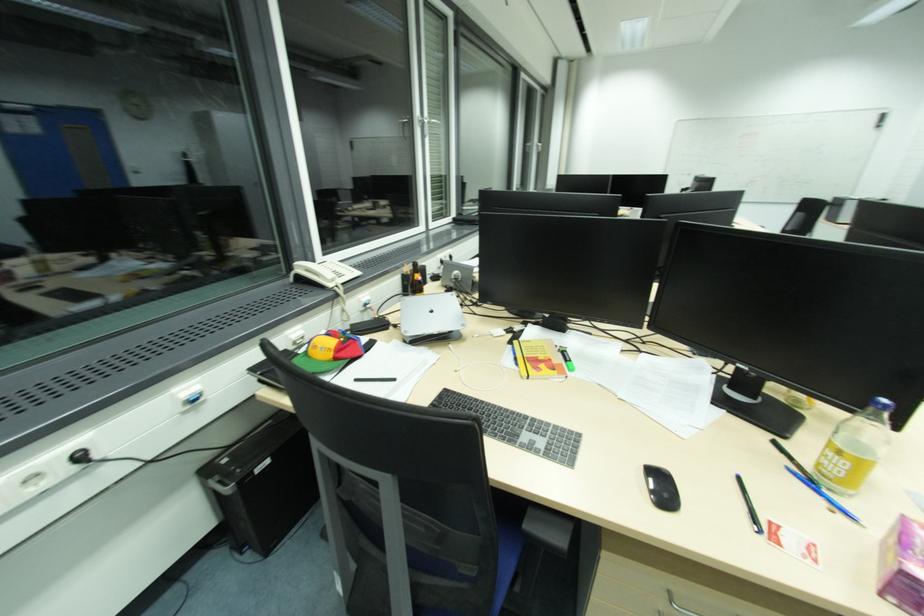
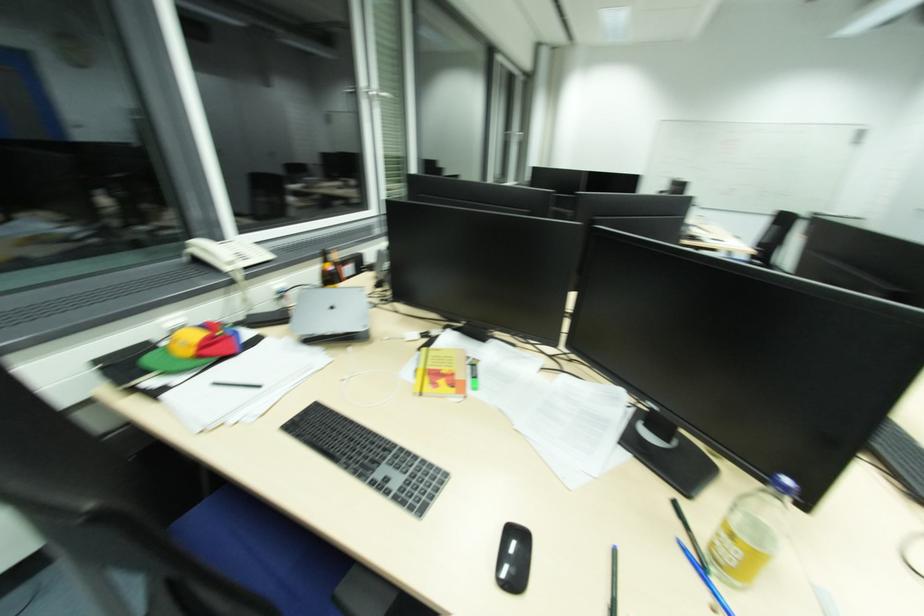
What movement of the cameraman would produce the second image?

The cameraman moved toward right, forward.